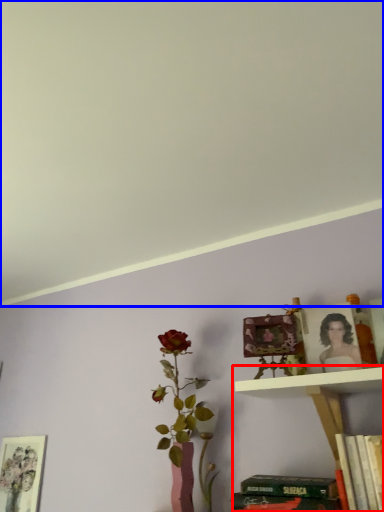
Question: Which object is closer to the camera taking this photo, shelf (highlighted by a red box) or backdrop (highlighted by a blue box)?

Choices:
 (A) shelf
 (B) backdrop

Answer: (B)